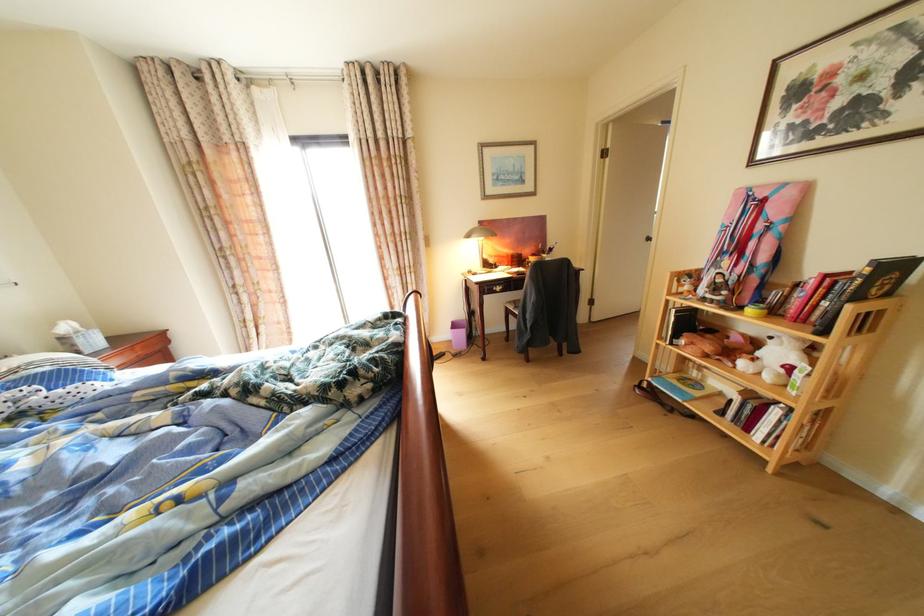
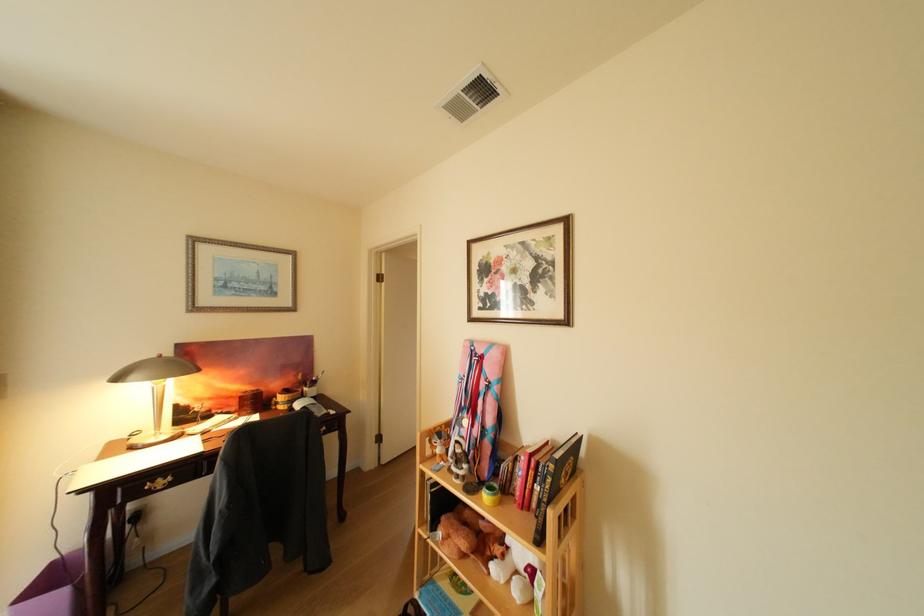
Locate, in the second image, the point that corresponds to [763,312] in the first image.

(499, 499)